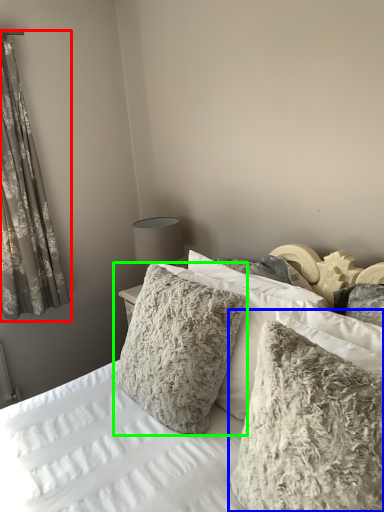
Question: Which object is positioned closest to curtain (highlighted by a red box)? Select from pillow (highlighted by a blue box) and pillow (highlighted by a green box).

Choices:
 (A) pillow
 (B) pillow

Answer: (B)